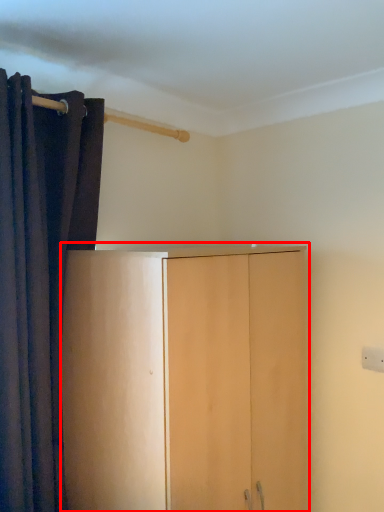
Question: Where is cupboard (annotated by the red box) located in relation to curtain in the image?

Choices:
 (A) left
 (B) right

Answer: (B)